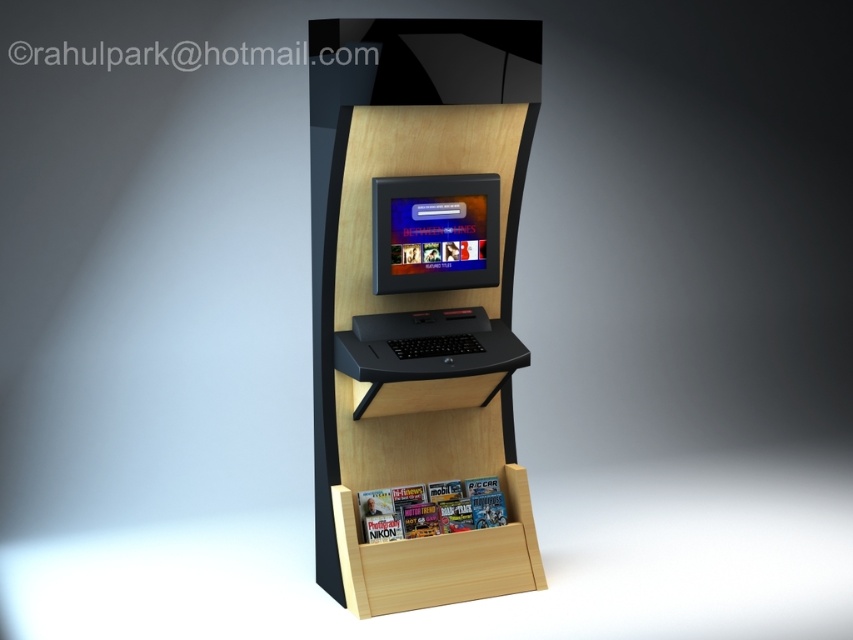
You are standing in front of the kiosk and need to locate the matte black laptop at center. According to the coordinate system where the bottom left corner is the origin, can you confirm its position?

The matte black laptop at center is located at point coordinates of 0.364 in the x and 0.510 in the y.

You are a technician checking the kiosk. You see the matte black laptop at center and the black matte laptop at center. Which one is taller?

The matte black laptop at center is much taller than the black matte laptop at center.